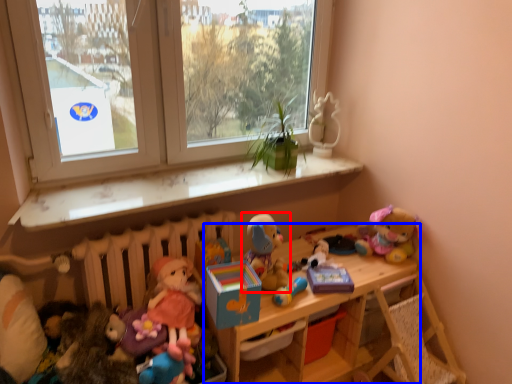
Question: Which object appears farthest to the camera in this image, toy (highlighted by a red box) or shelf (highlighted by a blue box)?

Choices:
 (A) toy
 (B) shelf

Answer: (A)